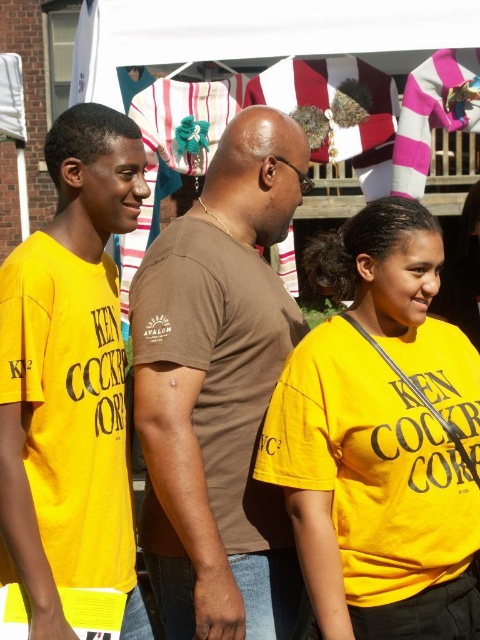
Who is more distant from viewer, (408, 296) or (230, 276)?

Point (230, 276)

Consider the image. Is yellow matte shirt at center wider than brown cotton t-shirt at center?

Yes, yellow matte shirt at center is wider than brown cotton t-shirt at center.

Is point (310, 484) farther from camera compared to point (164, 426)?

No, it is not.

The height and width of the screenshot is (640, 480). In order to click on yellow matte shirt at center in this screenshot , I will do `click(381, 438)`.

Can you confirm if brown cotton t-shirt at center is positioned below yellow cotton t-shirt at left?

Incorrect, brown cotton t-shirt at center is not positioned below yellow cotton t-shirt at left.

Which is more to the left, brown cotton t-shirt at center or yellow cotton t-shirt at left?

yellow cotton t-shirt at left

Who is more forward, (x=218, y=212) or (x=49, y=253)?

Point (x=49, y=253) is in front.

Find the location of a particular element. brown cotton t-shirt at center is located at coordinates (218, 390).

Which is in front, point (327, 246) or point (58, 593)?

Point (58, 593) is more forward.

Can you confirm if yellow matte shirt at center is thinner than yellow cotton t-shirt at left?

No.

Identify the location of yellow matte shirt at center. (381, 438).